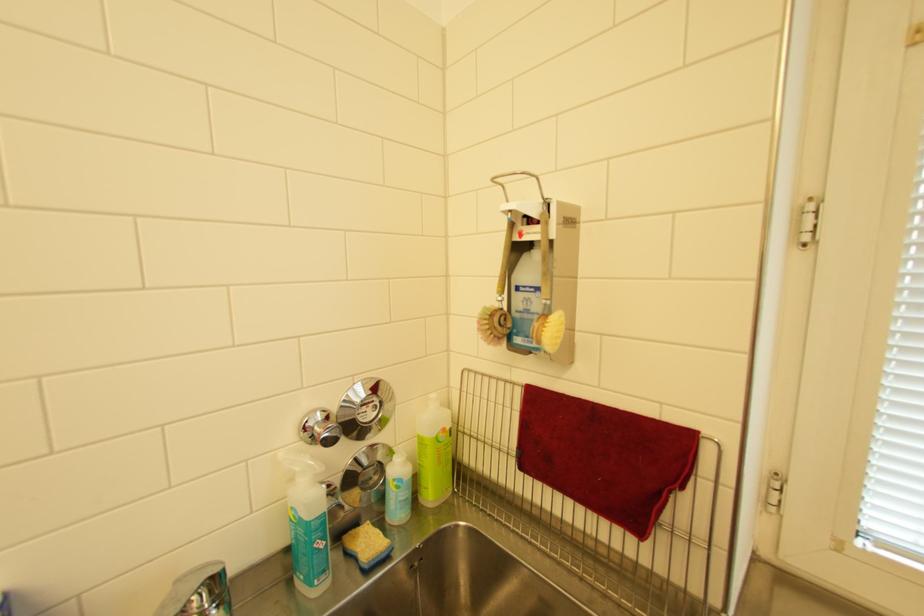
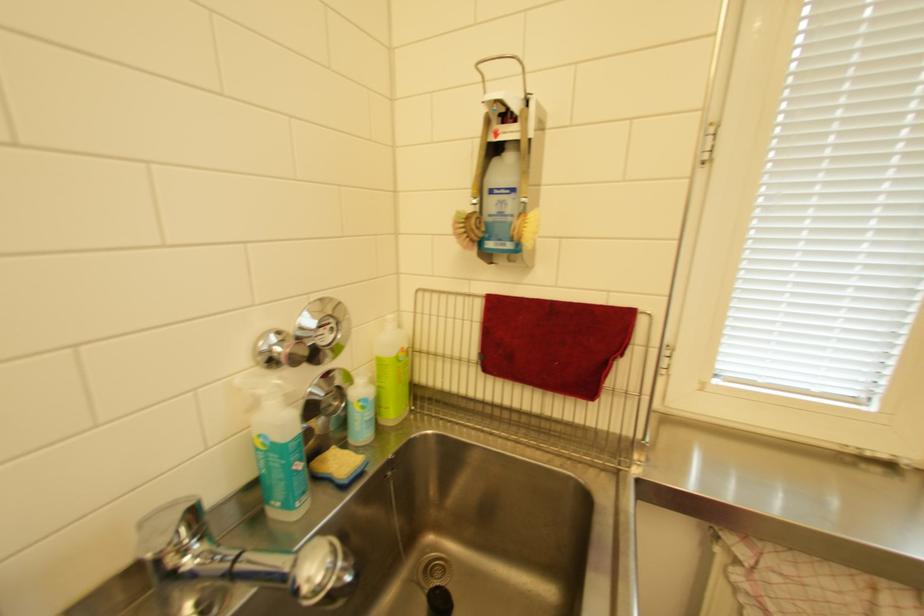
The point at (429, 440) is marked in the first image. Where is the corresponding point in the second image?

(386, 362)